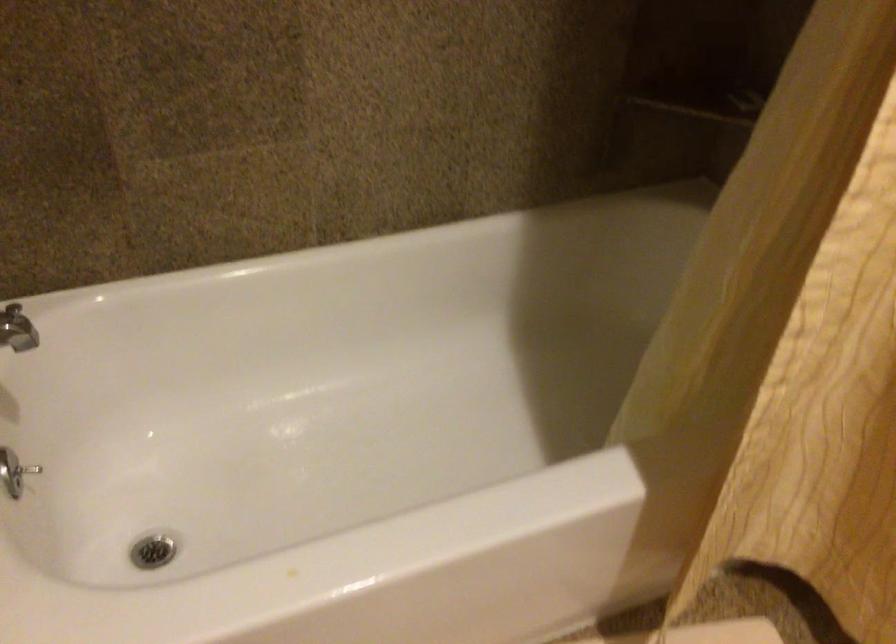
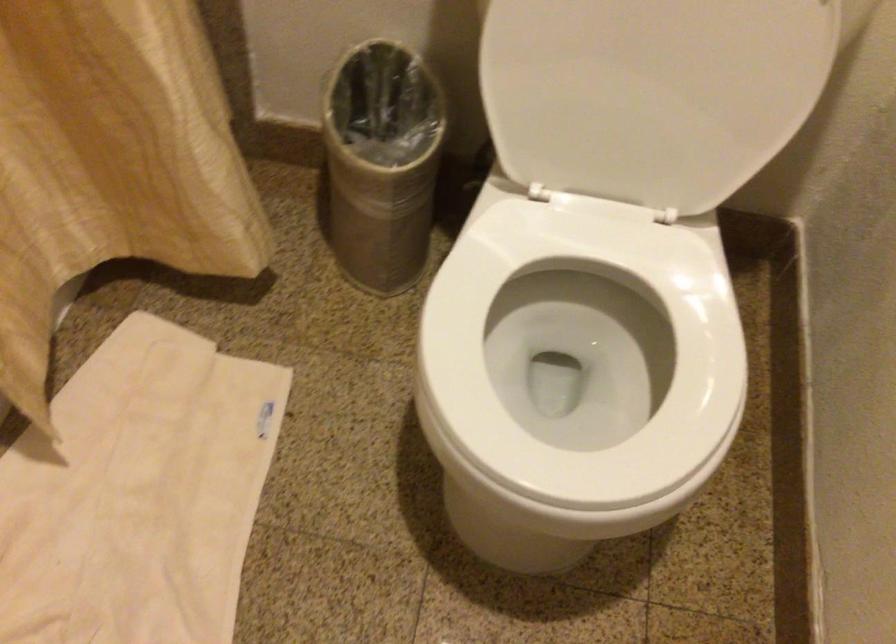
In the scene shown: The first image is from the beginning of the video and the second image is from the end. How did the camera likely rotate when shooting the video?

The rotation direction of the camera is right-down.